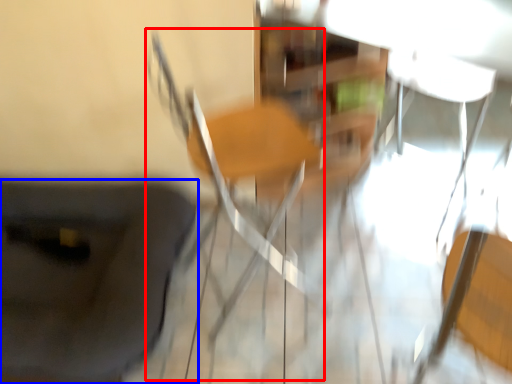
Question: Among these objects, which one is farthest to the camera, chair (highlighted by a red box) or furniture (highlighted by a blue box)?

Choices:
 (A) chair
 (B) furniture

Answer: (B)